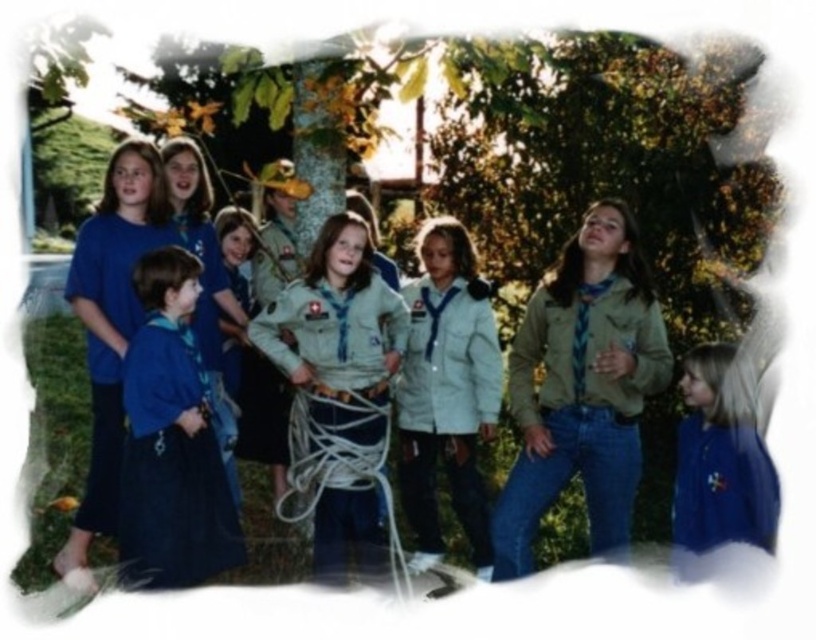
You are a scout leader trying to determine which of the two blue shirts is more suitable for a climbing activity. Considering the material thickness, which shirt should you choose between the blue matte shirt at lower right and the blue fabric shirt at left?

The blue matte shirt at lower right is thinner than the blue fabric shirt at left. For climbing activities, a thicker material might provide better protection, so the blue fabric shirt at left would be more suitable.

You are a photographer trying to capture a photo of both the blue matte shirt at lower right and the blue fabric shirt at left. Which shirt should you focus on first to ensure both are in focus?

You should focus on the blue matte shirt at lower right first because it is closer to the viewer than the blue fabric shirt at left, so adjusting focus from near to far will help both shirts be in focus.